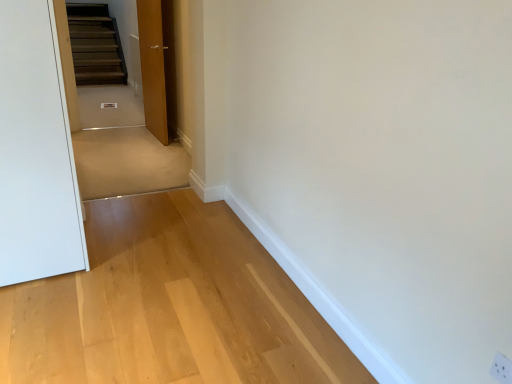
Question: Considering the positions of matte wood door at center and white plastic outlet at lower right in the image, is matte wood door at center wider or thinner than white plastic outlet at lower right?

Choices:
 (A) thin
 (B) wide

Answer: (B)

Question: Based on their positions, is matte wood door at center located to the left or right of white plastic outlet at lower right?

Choices:
 (A) left
 (B) right

Answer: (A)

Question: Do you think matte wood door at center is within white plastic outlet at lower right, or outside of it?

Choices:
 (A) inside
 (B) outside

Answer: (B)

Question: From a real-world perspective, is white plastic outlet at lower right above or below matte wood door at center?

Choices:
 (A) above
 (B) below

Answer: (B)

Question: In the image, is white plastic outlet at lower right on the left side or the right side of matte wood door at center?

Choices:
 (A) right
 (B) left

Answer: (A)

Question: Is white plastic outlet at lower right taller or shorter than matte wood door at center?

Choices:
 (A) tall
 (B) short

Answer: (B)

Question: Considering their positions, is white plastic outlet at lower right located in front of or behind matte wood door at center?

Choices:
 (A) behind
 (B) front

Answer: (B)